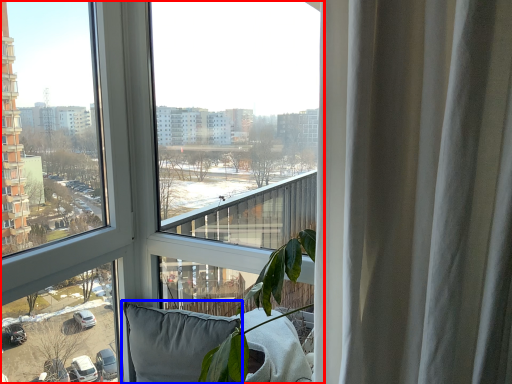
Question: Which object is further to the camera taking this photo, window (highlighted by a red box) or pillow (highlighted by a blue box)?

Choices:
 (A) window
 (B) pillow

Answer: (B)